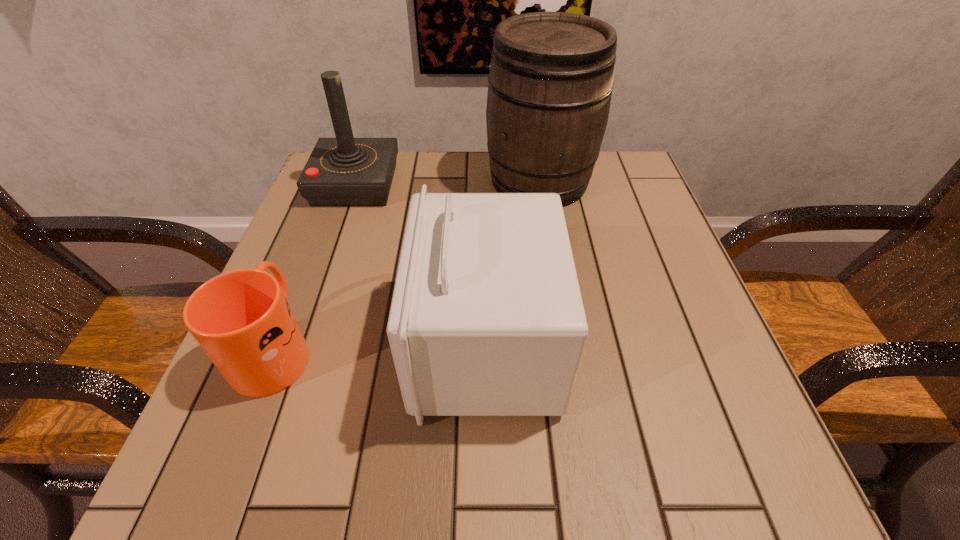
The height and width of the screenshot is (540, 960). I want to click on vacant space located on the handle side of the mug, so click(x=305, y=271).

The height and width of the screenshot is (540, 960). Find the location of `free space located on the handle side of the mug`. free space located on the handle side of the mug is located at coordinates (321, 230).

Locate an element on the screen. This screenshot has width=960, height=540. wine bucket located at the far edge is located at coordinates (550, 84).

Locate an element on the screen. This screenshot has height=540, width=960. joystick present at the far edge is located at coordinates (344, 171).

You are a GUI agent. You are given a task and a screenshot of the screen. Output one action in this format:
    pyautogui.click(x=<x>, y=<y>)
    Task: Click on the joystick that is at the left edge
    The width and height of the screenshot is (960, 540).
    Given the screenshot: What is the action you would take?
    pyautogui.click(x=344, y=171)

Where is `mug situated at the left edge`? The image size is (960, 540). mug situated at the left edge is located at coordinates (241, 319).

I want to click on object situated at the right edge, so click(550, 84).

This screenshot has height=540, width=960. Find the location of `object at the far left corner`. object at the far left corner is located at coordinates (x=344, y=171).

Where is `object that is at the far right corner`? The image size is (960, 540). object that is at the far right corner is located at coordinates (550, 84).

Find the location of a particular element. This screenshot has width=960, height=540. vacant space at the far edge of the desktop is located at coordinates (406, 157).